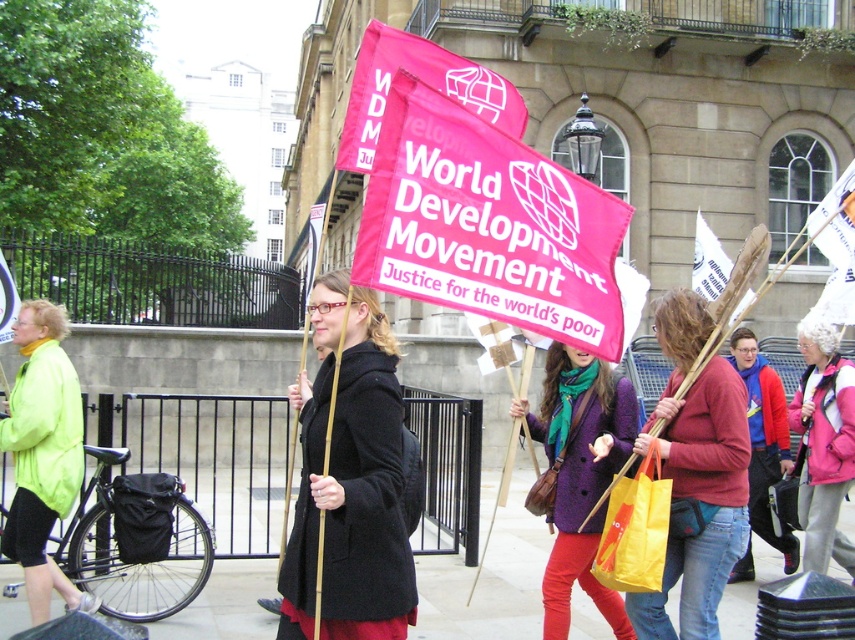
Question: Which object is farther from the camera taking this photo?

Choices:
 (A) purple wool coat at center
 (B) matte black coat at center
 (C) matte pink scarf at center

Answer: (A)

Question: Is matte black coat at center further to camera compared to matte pink scarf at center?

Choices:
 (A) yes
 (B) no

Answer: (B)

Question: Is matte black coat at center wider than purple wool coat at center?

Choices:
 (A) yes
 (B) no

Answer: (B)

Question: Which object is closer to the camera taking this photo?

Choices:
 (A) matte black coat at center
 (B) matte pink scarf at center
 (C) purple wool coat at center

Answer: (A)

Question: Is matte black coat at center positioned at the back of matte pink scarf at center?

Choices:
 (A) yes
 (B) no

Answer: (B)

Question: Which object is farther from the camera taking this photo?

Choices:
 (A) matte black coat at center
 (B) matte pink scarf at center
 (C) purple wool coat at center

Answer: (C)